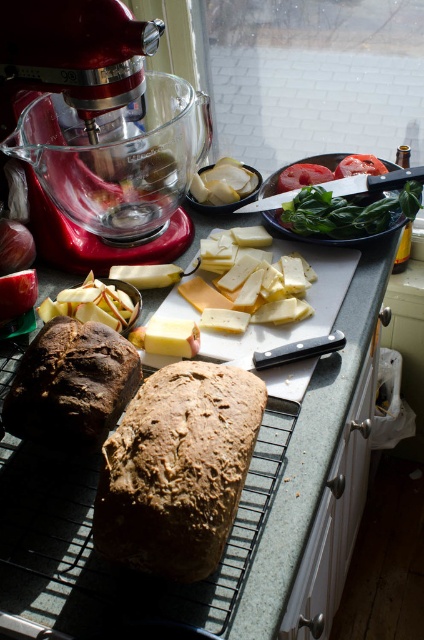
Question: Which point is closer to the camera?

Choices:
 (A) red metallic stand mixer at upper left
 (B) metallic silver platter at center
 (C) yellow cheese at center

Answer: (A)

Question: Is dark brown crusty loaf of bread at lower left above metallic silver platter at center?

Choices:
 (A) no
 (B) yes

Answer: (A)

Question: Does red metallic stand mixer at upper left come behind dark brown crusty loaf of bread at lower left?

Choices:
 (A) no
 (B) yes

Answer: (B)

Question: Among these objects, which one is nearest to the camera?

Choices:
 (A) translucent plastic bag at center
 (B) red metallic stand mixer at upper left
 (C) brown rustic loaf at center

Answer: (C)

Question: Which point is farther from the camera taking this photo?

Choices:
 (A) (147, 461)
 (B) (95, 80)

Answer: (B)

Question: Is red metallic stand mixer at upper left below yellow cheese at center?

Choices:
 (A) yes
 (B) no

Answer: (B)